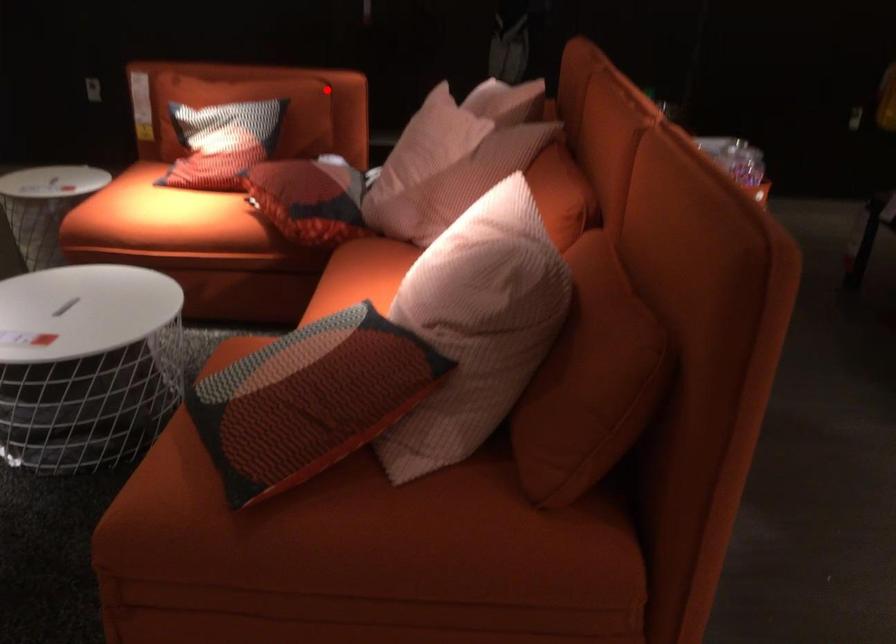
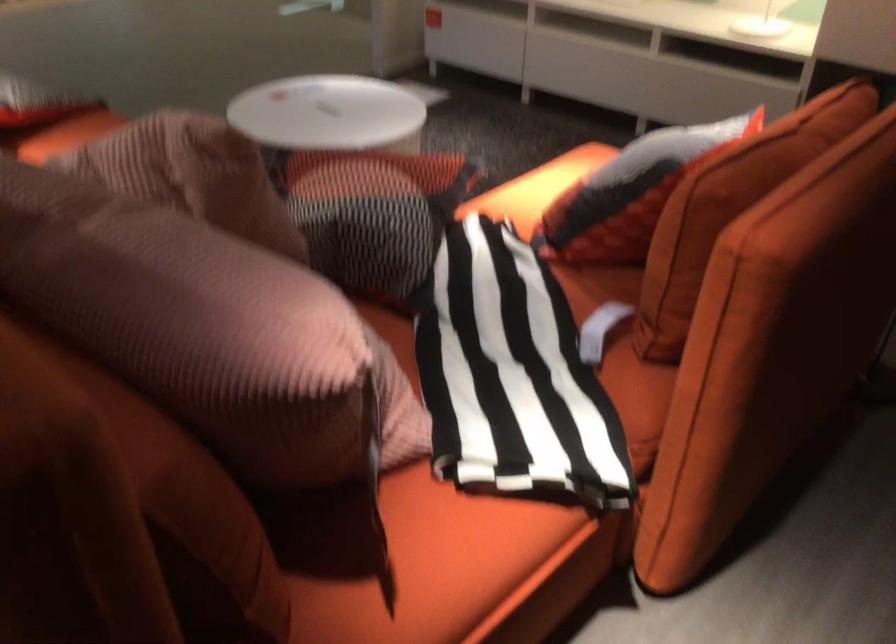
Locate, in the second image, the point that corresponds to the highlighted location in the first image.

(730, 207)